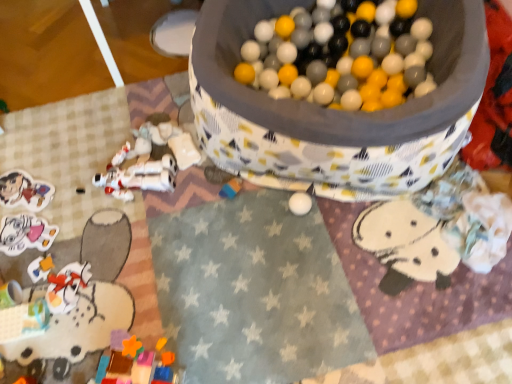
The height and width of the screenshot is (384, 512). What are the coordinates of `free space behind plastic toy figure at lower left, positioned as the third toy in left-to-right order` in the screenshot? It's located at (65, 230).